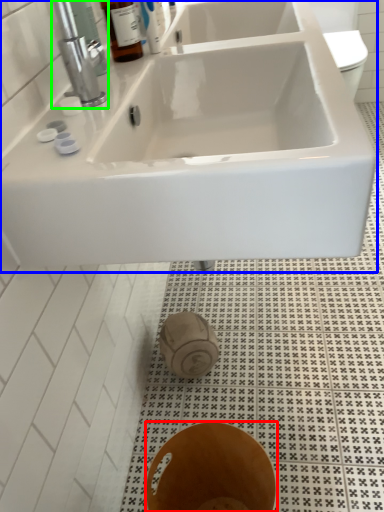
Question: Which object is the closest to the bidet (highlighted by a red box)? Choose among these: sink (highlighted by a blue box) or tap (highlighted by a green box).

Choices:
 (A) sink
 (B) tap

Answer: (A)